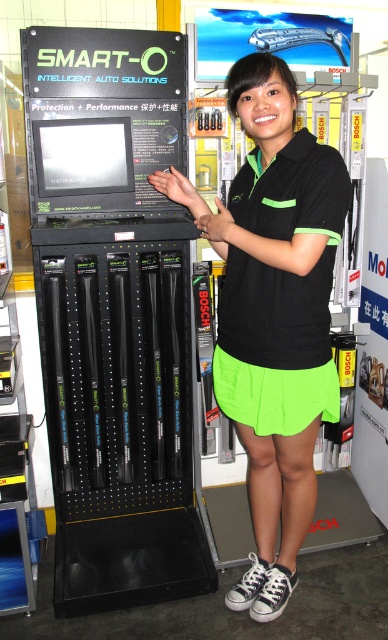
Question: Does black matte shirt at center appear under neon green fabric skirt at center?

Choices:
 (A) yes
 (B) no

Answer: (A)

Question: Is neon green fabric skirt at center below neon green fabric shorts at center?

Choices:
 (A) no
 (B) yes

Answer: (A)

Question: Which object appears closest to the camera in this image?

Choices:
 (A) neon green fabric shorts at center
 (B) black matte shirt at center

Answer: (B)

Question: Which of the following is the closest to the observer?

Choices:
 (A) neon green fabric shorts at center
 (B) neon green fabric skirt at center
 (C) black matte shirt at center

Answer: (B)

Question: Can you confirm if neon green fabric skirt at center is positioned above neon green fabric shorts at center?

Choices:
 (A) no
 (B) yes

Answer: (B)

Question: Which object appears closest to the camera in this image?

Choices:
 (A) black matte shirt at center
 (B) neon green fabric shorts at center
 (C) neon green fabric skirt at center

Answer: (C)